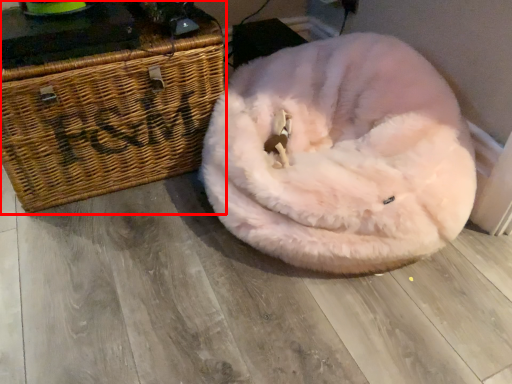
Question: From the image's perspective, considering the relative positions of furniture (annotated by the red box) and dog bed in the image provided, where is furniture (annotated by the red box) located with respect to the staircase?

Choices:
 (A) above
 (B) below

Answer: (A)